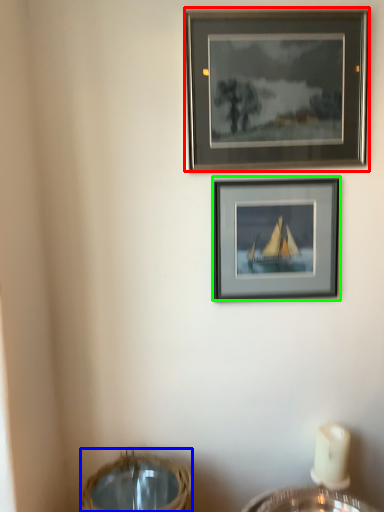
Question: Considering the real-world distances, which object is closest to picture frame (highlighted by a red box)? basket (highlighted by a blue box) or picture frame (highlighted by a green box).

Choices:
 (A) basket
 (B) picture frame

Answer: (B)